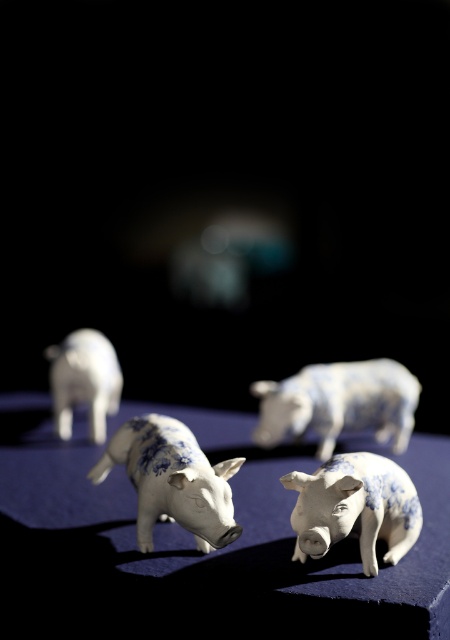
You are standing in front of a display of ceramic pigs. There is a blue and white ceramic pig at center. If you want to reach it without moving closer than 3 feet, can you just barely touch it?

The blue and white ceramic pig at center is 3.30 feet away from the viewer. Since 3.30 feet is slightly more than 3 feet, you cannot just barely touch it without moving closer.

You are an art curator arranging an exhibition. You have two pigs to place on a shelf. The blue and white porcelain pig at center and the white glossy pig at left. Which pig requires a larger space on the shelf due to its size?

The blue and white porcelain pig at center requires a larger space on the shelf because it has a larger size compared to the white glossy pig at left.